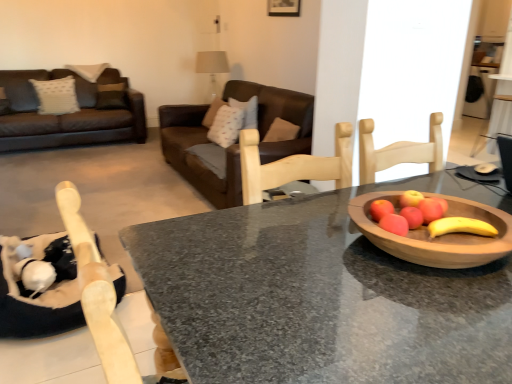
Question: From a real-world perspective, is brown leather couch at center positioned under granite table at center based on gravity?

Choices:
 (A) no
 (B) yes

Answer: (A)

Question: From the image's perspective, is brown leather couch at center located above granite table at center?

Choices:
 (A) no
 (B) yes

Answer: (B)

Question: Is brown leather couch at center to the left of granite table at center from the viewer's perspective?

Choices:
 (A) yes
 (B) no

Answer: (A)

Question: Is there a large distance between brown leather couch at center and granite table at center?

Choices:
 (A) no
 (B) yes

Answer: (B)

Question: Are brown leather couch at center and granite table at center beside each other?

Choices:
 (A) yes
 (B) no

Answer: (B)

Question: In terms of size, does brown leather couch at center appear bigger or smaller than wooden bowl at right?

Choices:
 (A) small
 (B) big

Answer: (B)

Question: Is brown leather couch at center inside the boundaries of wooden bowl at right, or outside?

Choices:
 (A) inside
 (B) outside

Answer: (B)

Question: Is point (207, 200) closer or farther from the camera than point (508, 246)?

Choices:
 (A) farther
 (B) closer

Answer: (A)

Question: Looking at their shapes, would you say brown leather couch at center is wider or thinner than wooden bowl at right?

Choices:
 (A) wide
 (B) thin

Answer: (A)

Question: From a real-world perspective, is brown leather couch at center above or below granite table at center?

Choices:
 (A) above
 (B) below

Answer: (A)

Question: In terms of size, does brown leather couch at center appear bigger or smaller than granite table at center?

Choices:
 (A) big
 (B) small

Answer: (A)

Question: Looking at their shapes, would you say brown leather couch at center is wider or thinner than granite table at center?

Choices:
 (A) wide
 (B) thin

Answer: (B)

Question: Is brown leather couch at center taller or shorter than granite table at center?

Choices:
 (A) tall
 (B) short

Answer: (A)

Question: Would you say wooden bowl at right is to the left or to the right of brown leather couch at center in the picture?

Choices:
 (A) right
 (B) left

Answer: (A)

Question: Based on their sizes in the image, would you say wooden bowl at right is bigger or smaller than brown leather couch at center?

Choices:
 (A) small
 (B) big

Answer: (A)